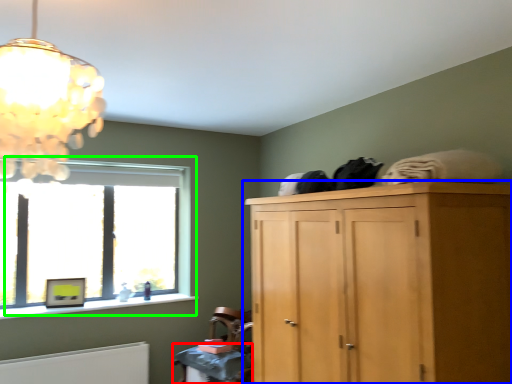
Question: Which is farther away from table (highlighted by a red box)? cupboard (highlighted by a blue box) or window (highlighted by a green box)?

Choices:
 (A) cupboard
 (B) window

Answer: (B)